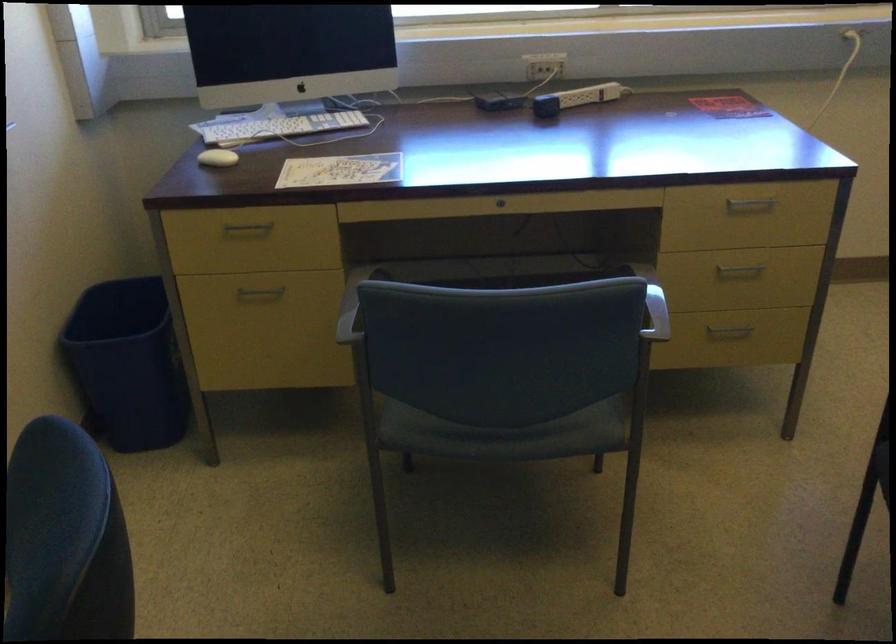
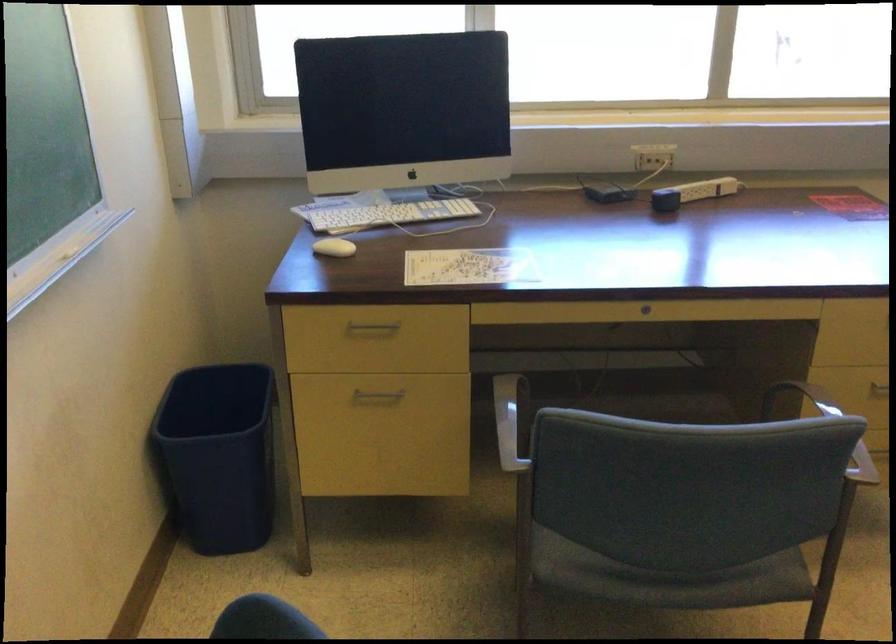
Question: The images are taken continuously from a first-person perspective. In which direction is your viewpoint rotating?

Choices:
 (A) Left
 (B) Right
 (C) Up
 (D) Down

Answer: (C)